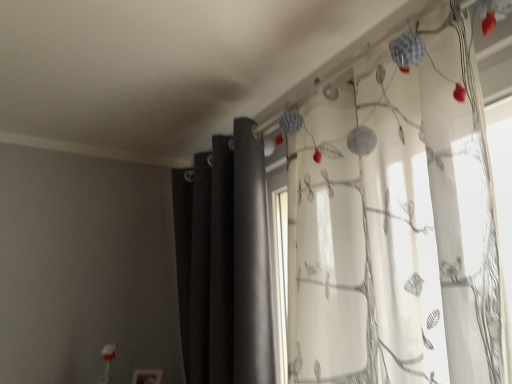
Question: From a real-world perspective, is dark matte curtain at center, marked as the 1th curtain in a left-to-right arrangement, positioned over white sheer curtain with floral pattern at right, which is the second curtain in left-to-right order, based on gravity?

Choices:
 (A) no
 (B) yes

Answer: (A)

Question: Is dark matte curtain at center, marked as the 1th curtain in a left-to-right arrangement, looking in the opposite direction of white sheer curtain with floral pattern at right, which is the second curtain in left-to-right order?

Choices:
 (A) no
 (B) yes

Answer: (A)

Question: From a real-world perspective, is dark matte curtain at center, which appears as the second curtain when viewed from the right, positioned under white sheer curtain with floral pattern at right, which is the second curtain in left-to-right order, based on gravity?

Choices:
 (A) no
 (B) yes

Answer: (B)

Question: Considering the relative sizes of dark matte curtain at center, marked as the 1th curtain in a left-to-right arrangement, and white sheer curtain with floral pattern at right, marked as the first curtain in a right-to-left arrangement, in the image provided, is dark matte curtain at center, marked as the 1th curtain in a left-to-right arrangement, thinner than white sheer curtain with floral pattern at right, marked as the first curtain in a right-to-left arrangement,?

Choices:
 (A) yes
 (B) no

Answer: (A)

Question: Is dark matte curtain at center, which appears as the second curtain when viewed from the right, directly adjacent to white sheer curtain with floral pattern at right, which is the second curtain in left-to-right order?

Choices:
 (A) yes
 (B) no

Answer: (B)

Question: Is dark matte curtain at center, marked as the 1th curtain in a left-to-right arrangement, taller than white sheer curtain with floral pattern at right, which is the second curtain in left-to-right order?

Choices:
 (A) yes
 (B) no

Answer: (A)

Question: Can you confirm if white sheer curtain with floral pattern at right, which is the second curtain in left-to-right order, is taller than dark matte curtain at center, marked as the 1th curtain in a left-to-right arrangement?

Choices:
 (A) yes
 (B) no

Answer: (B)

Question: Is white sheer curtain with floral pattern at right, which is the second curtain in left-to-right order, far from dark matte curtain at center, marked as the 1th curtain in a left-to-right arrangement?

Choices:
 (A) no
 (B) yes

Answer: (A)

Question: From the image's perspective, is white sheer curtain with floral pattern at right, marked as the first curtain in a right-to-left arrangement, located beneath dark matte curtain at center, which appears as the second curtain when viewed from the right?

Choices:
 (A) no
 (B) yes

Answer: (A)

Question: Is white sheer curtain with floral pattern at right, marked as the first curtain in a right-to-left arrangement, at the left side of dark matte curtain at center, marked as the 1th curtain in a left-to-right arrangement?

Choices:
 (A) yes
 (B) no

Answer: (B)

Question: Is white sheer curtain with floral pattern at right, marked as the first curtain in a right-to-left arrangement, outside dark matte curtain at center, marked as the 1th curtain in a left-to-right arrangement?

Choices:
 (A) no
 (B) yes

Answer: (B)

Question: Is the depth of white sheer curtain with floral pattern at right, marked as the first curtain in a right-to-left arrangement, less than that of dark matte curtain at center, which appears as the second curtain when viewed from the right?

Choices:
 (A) yes
 (B) no

Answer: (A)

Question: Does point (288, 157) appear closer or farther from the camera than point (258, 185)?

Choices:
 (A) closer
 (B) farther

Answer: (B)